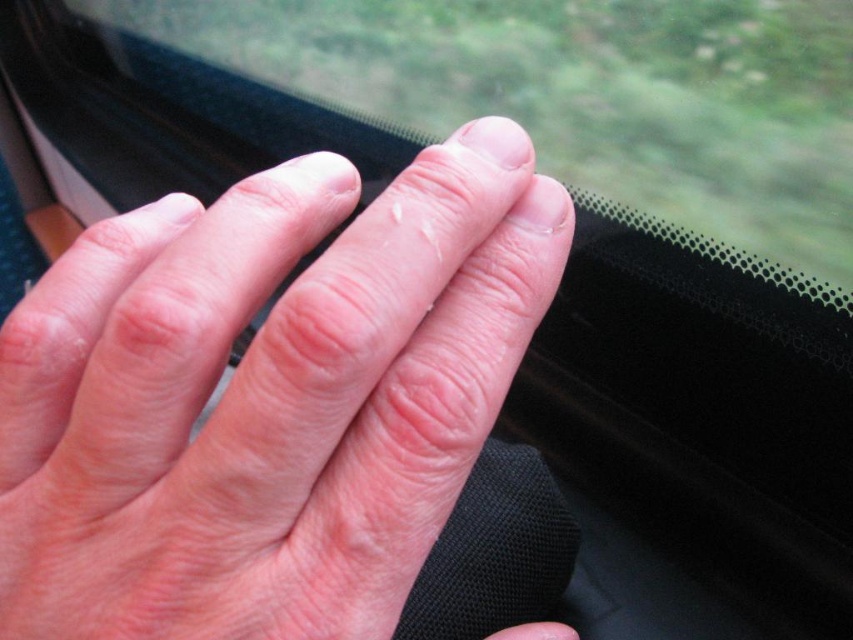
Question: Among these objects, which one is nearest to the camera?

Choices:
 (A) transparent plastic train window at center
 (B) pale skin at center

Answer: (B)

Question: Which point appears farthest from the camera in this image?

Choices:
 (A) (164, 384)
 (B) (743, 58)

Answer: (B)

Question: Is pale skin at center smaller than transparent plastic train window at center?

Choices:
 (A) no
 (B) yes

Answer: (B)

Question: Can you confirm if pale skin at center is smaller than transparent plastic train window at center?

Choices:
 (A) no
 (B) yes

Answer: (B)

Question: Does pale skin at center have a greater width compared to transparent plastic train window at center?

Choices:
 (A) yes
 (B) no

Answer: (B)

Question: Which point is closer to the camera?

Choices:
 (A) (222, 451)
 (B) (769, 77)

Answer: (A)